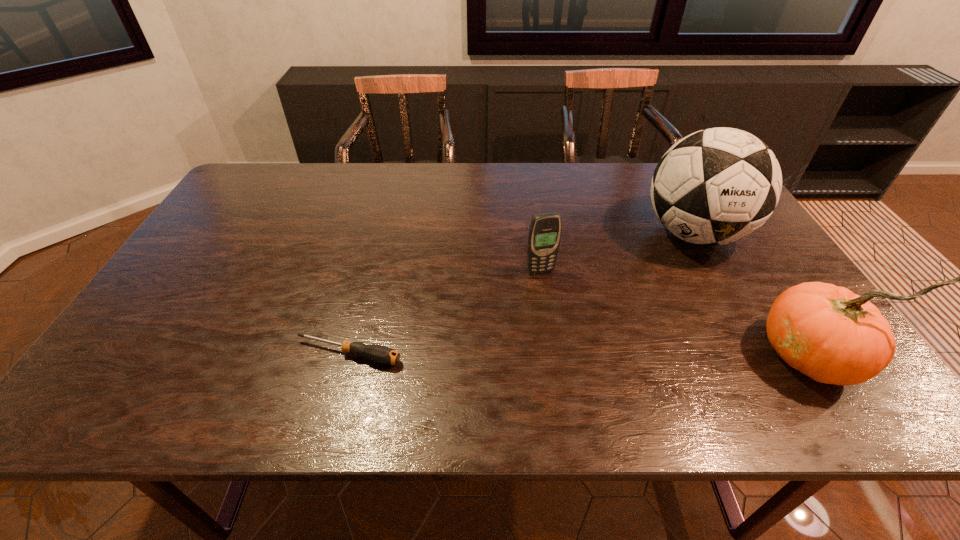
Identify the location of free region at the near edge of the desktop. The image size is (960, 540). (732, 350).

Locate an element on the screen. The width and height of the screenshot is (960, 540). free space at the left edge of the desktop is located at coordinates (232, 203).

Where is `vacant space at the far left corner`? vacant space at the far left corner is located at coordinates (270, 192).

Locate an element on the screen. The height and width of the screenshot is (540, 960). free spot between the pumpkin and the leftmost object is located at coordinates (580, 354).

You are a GUI agent. You are given a task and a screenshot of the screen. Output one action in this format:
    pyautogui.click(x=<x>, y=<y>)
    Task: Click on the unoccupied position between the screwdriver and the cellular telephone
    Image resolution: width=960 pixels, height=540 pixels.
    Given the screenshot: What is the action you would take?
    pyautogui.click(x=444, y=313)

The height and width of the screenshot is (540, 960). Identify the location of vacant region between the leftmost object and the soccer ball. (521, 294).

Where is `vacant point located between the soccer ball and the second shortest object`? This screenshot has width=960, height=540. vacant point located between the soccer ball and the second shortest object is located at coordinates (617, 253).

The image size is (960, 540). I want to click on vacant space that is in between the pumpkin and the screwdriver, so click(x=580, y=354).

You are a GUI agent. You are given a task and a screenshot of the screen. Output one action in this format:
    pyautogui.click(x=<x>, y=<y>)
    Task: Click on the vacant area that lies between the pumpkin and the soccer ball
    Image resolution: width=960 pixels, height=540 pixels.
    Given the screenshot: What is the action you would take?
    pyautogui.click(x=753, y=294)

Find the location of `vacant space in between the soccer ball and the second shortest object`. vacant space in between the soccer ball and the second shortest object is located at coordinates (617, 253).